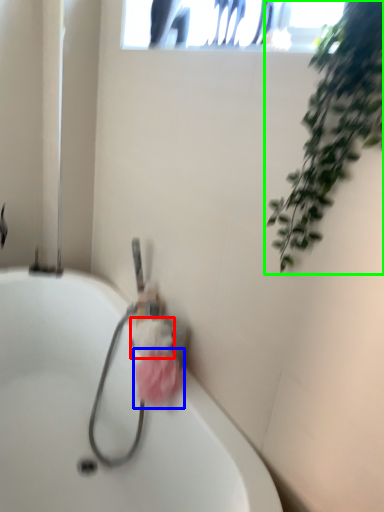
Question: Which object is positioned farthest from flower (highlighted by a red box)? Select from flower (highlighted by a blue box) and houseplant (highlighted by a green box).

Choices:
 (A) flower
 (B) houseplant

Answer: (B)